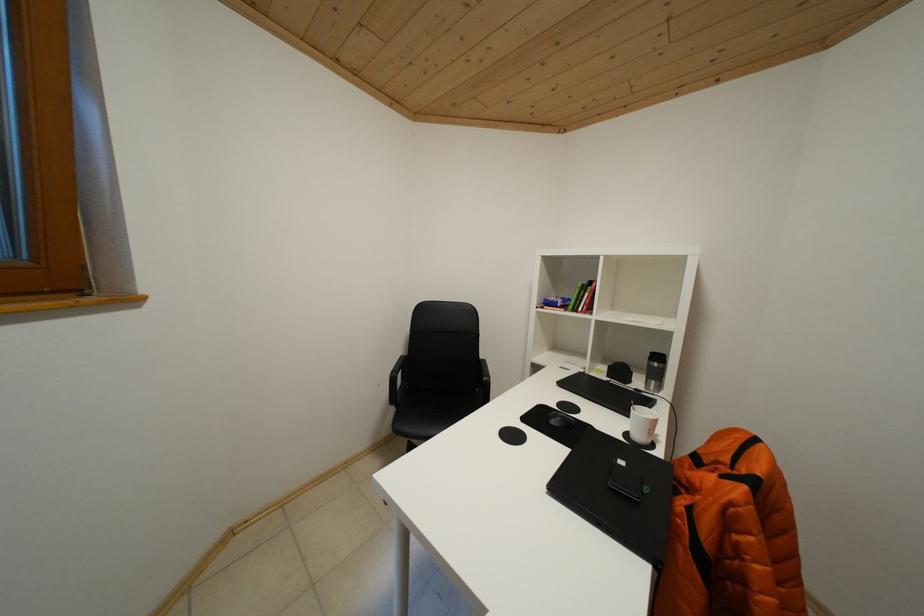
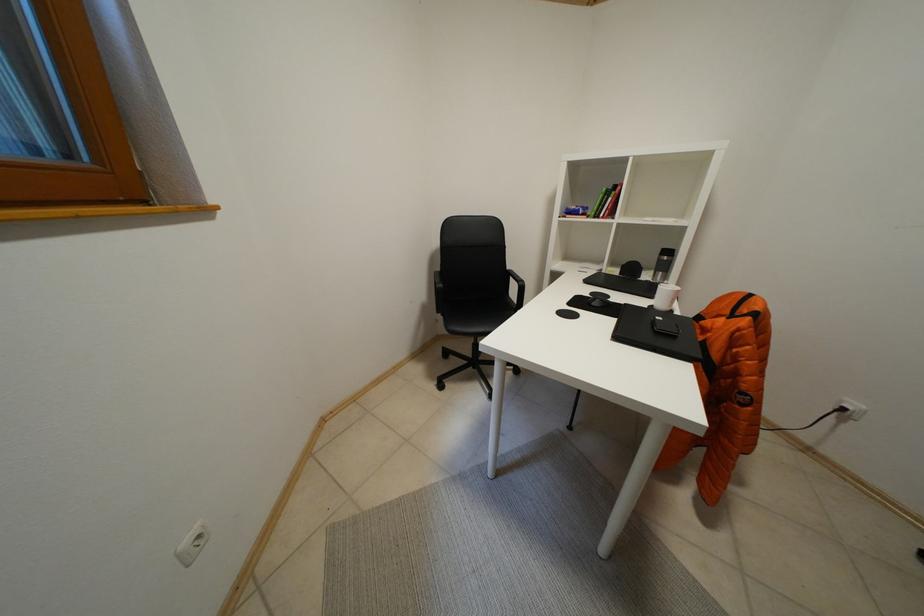
Question: Which direction would the cameraman need to move to produce the second image? Reply with the corresponding letter.

Choices:
 (A) Left
 (B) Right
 (C) Forward
 (D) Backward

Answer: (A)